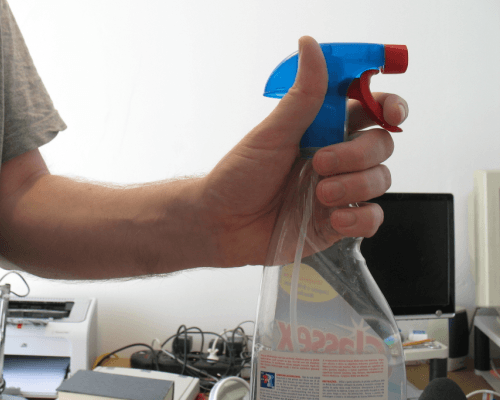
Where is `plugs`? The width and height of the screenshot is (500, 400). plugs is located at coordinates (188, 352), (212, 359), (230, 349).